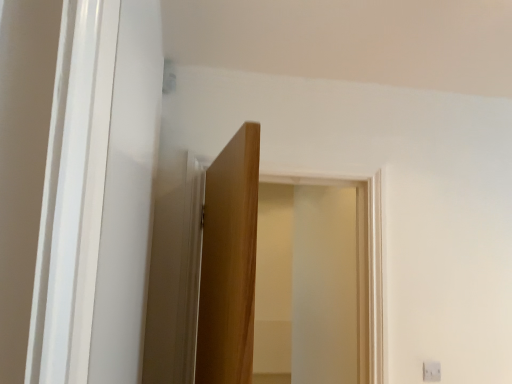
Question: Considering the relative sizes of transparent glass door at center and white plastic light switch at lower right in the image provided, is transparent glass door at center smaller than white plastic light switch at lower right?

Choices:
 (A) no
 (B) yes

Answer: (A)

Question: Is transparent glass door at center far from white plastic light switch at lower right?

Choices:
 (A) no
 (B) yes

Answer: (B)

Question: Considering the relative sizes of transparent glass door at center and white plastic light switch at lower right in the image provided, is transparent glass door at center thinner than white plastic light switch at lower right?

Choices:
 (A) yes
 (B) no

Answer: (B)

Question: Considering the relative sizes of transparent glass door at center and white plastic light switch at lower right in the image provided, is transparent glass door at center wider than white plastic light switch at lower right?

Choices:
 (A) yes
 (B) no

Answer: (A)

Question: From a real-world perspective, is transparent glass door at center positioned under white plastic light switch at lower right based on gravity?

Choices:
 (A) no
 (B) yes

Answer: (A)

Question: Could white plastic light switch at lower right be considered to be inside transparent glass door at center?

Choices:
 (A) no
 (B) yes

Answer: (A)

Question: Is white plastic light switch at lower right further to the viewer compared to transparent glass door at center?

Choices:
 (A) yes
 (B) no

Answer: (A)

Question: From a real-world perspective, is white plastic light switch at lower right physically above transparent glass door at center?

Choices:
 (A) no
 (B) yes

Answer: (A)

Question: Considering the relative sizes of white plastic light switch at lower right and transparent glass door at center in the image provided, is white plastic light switch at lower right thinner than transparent glass door at center?

Choices:
 (A) yes
 (B) no

Answer: (A)

Question: Does white plastic light switch at lower right have a larger size compared to transparent glass door at center?

Choices:
 (A) no
 (B) yes

Answer: (A)

Question: Is white plastic light switch at lower right smaller than transparent glass door at center?

Choices:
 (A) no
 (B) yes

Answer: (B)

Question: Is white plastic light switch at lower right oriented towards transparent glass door at center?

Choices:
 (A) no
 (B) yes

Answer: (A)

Question: Considering the relative positions of white plastic light switch at lower right and transparent glass door at center in the image provided, is white plastic light switch at lower right to the left or to the right of transparent glass door at center?

Choices:
 (A) left
 (B) right

Answer: (B)